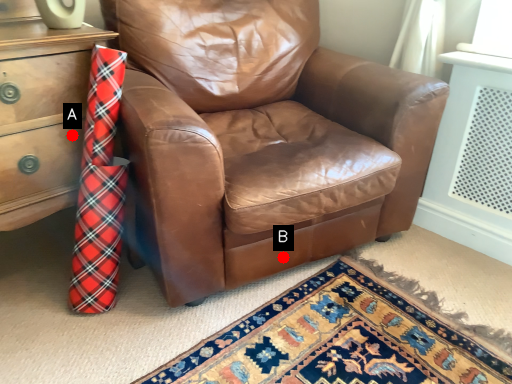
Question: Two points are circled on the image, labeled by A and B beside each circle. Which of the following is the farthest from the observer?

Choices:
 (A) A is further
 (B) B is further

Answer: (B)